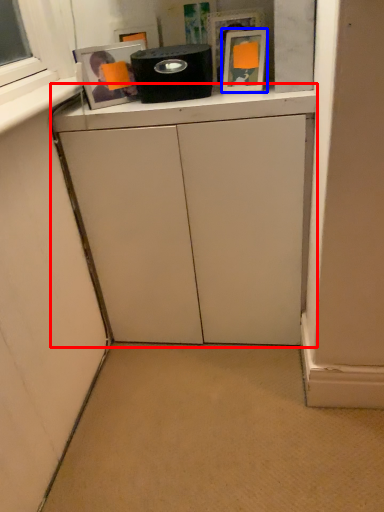
Question: Which object appears farthest to the camera in this image, cabinetry (highlighted by a red box) or picture frame (highlighted by a blue box)?

Choices:
 (A) cabinetry
 (B) picture frame

Answer: (B)